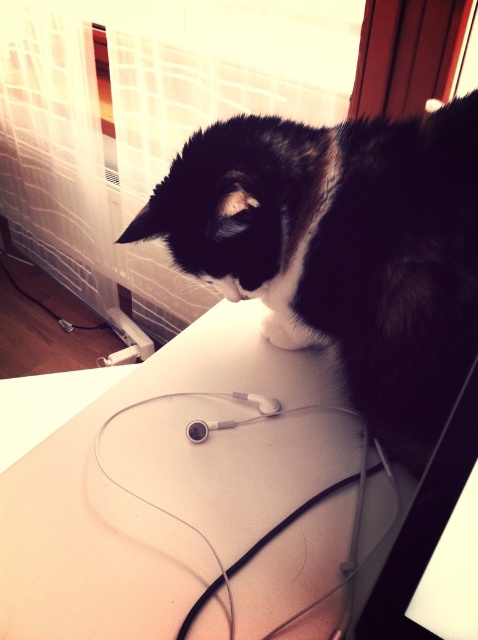
Question: Does black fur cat at upper center appear under black glossy monitor at upper right?

Choices:
 (A) yes
 (B) no

Answer: (B)

Question: Which point is farther from the camera taking this photo?

Choices:
 (A) (420, 502)
 (B) (118, 516)
 (C) (369, 168)

Answer: (C)

Question: Which of the following is the farthest from the observer?

Choices:
 (A) click(337, 321)
 (B) click(71, 632)
 (C) click(473, 461)

Answer: (A)

Question: Observing the image, what is the correct spatial positioning of white matte computer desk at center in reference to black glossy monitor at upper right?

Choices:
 (A) above
 (B) below

Answer: (B)

Question: Is white matte computer desk at center closer to camera compared to black glossy monitor at upper right?

Choices:
 (A) yes
 (B) no

Answer: (B)

Question: Considering the real-world distances, which object is closest to the black fur cat at upper center?

Choices:
 (A) white matte computer desk at center
 (B) black glossy monitor at upper right

Answer: (A)